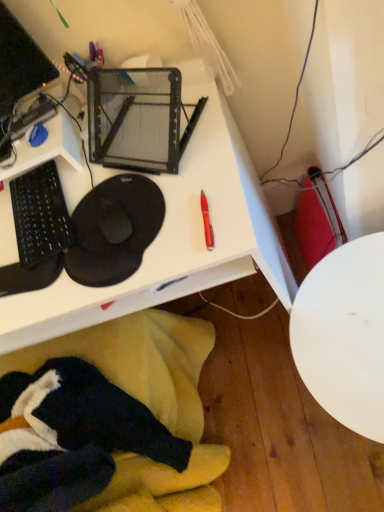
Locate an element on the screen. free spot to the right of black matte mouse pad at left is located at coordinates (178, 147).